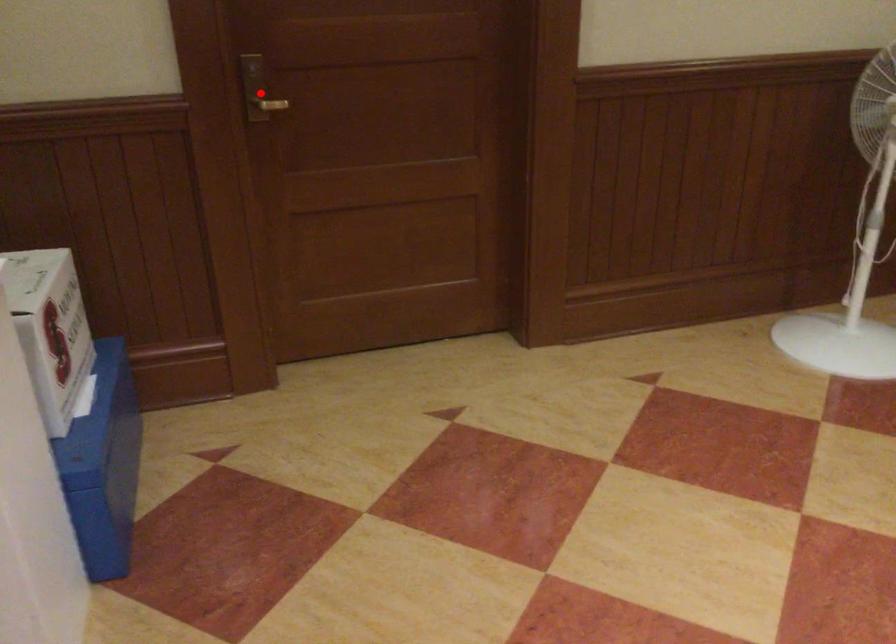
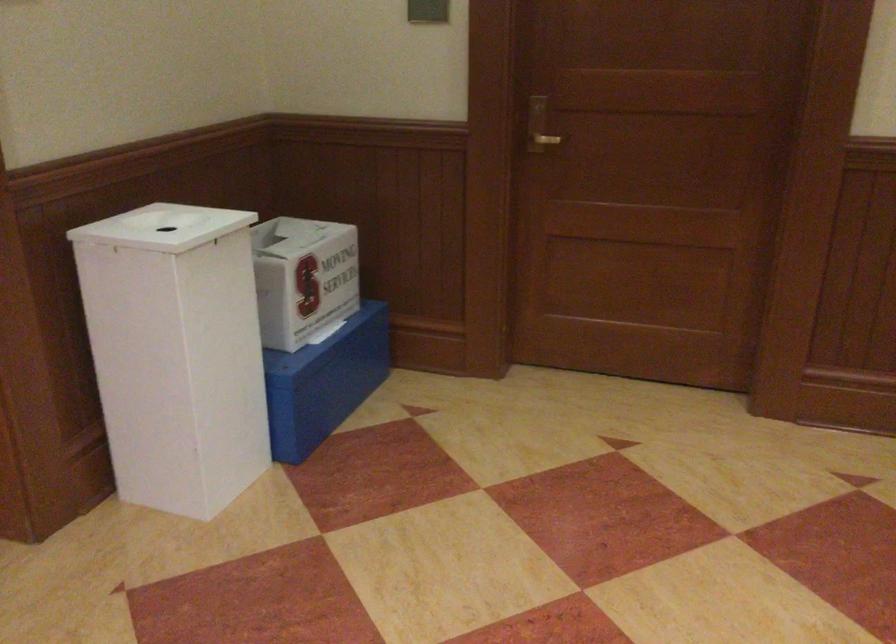
In the second image, find the point that corresponds to the highlighted location in the first image.

(538, 126)